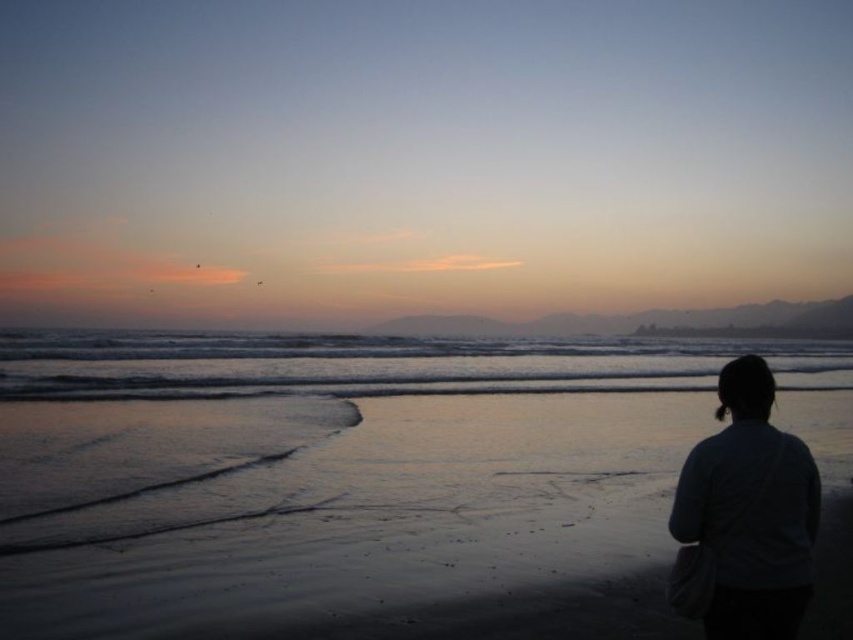
Question: In this image, where is shiny golden water at center located relative to dark gray sweater at lower right?

Choices:
 (A) below
 (B) above

Answer: (A)

Question: Which object is the farthest from the dark gray sweater at lower right?

Choices:
 (A) smooth sand at lower right
 (B) shiny golden water at center

Answer: (B)

Question: Can you confirm if shiny golden water at center is positioned above dark gray sweater at lower right?

Choices:
 (A) yes
 (B) no

Answer: (B)

Question: Does smooth sand at lower right have a lesser width compared to dark gray sweater at lower right?

Choices:
 (A) yes
 (B) no

Answer: (B)

Question: Among these points, which one is farthest from the camera?

Choices:
 (A) (126, 518)
 (B) (339, 376)
 (C) (720, 616)

Answer: (B)

Question: Which of the following is the farthest from the observer?

Choices:
 (A) (521, 355)
 (B) (759, 464)
 (C) (660, 570)

Answer: (A)